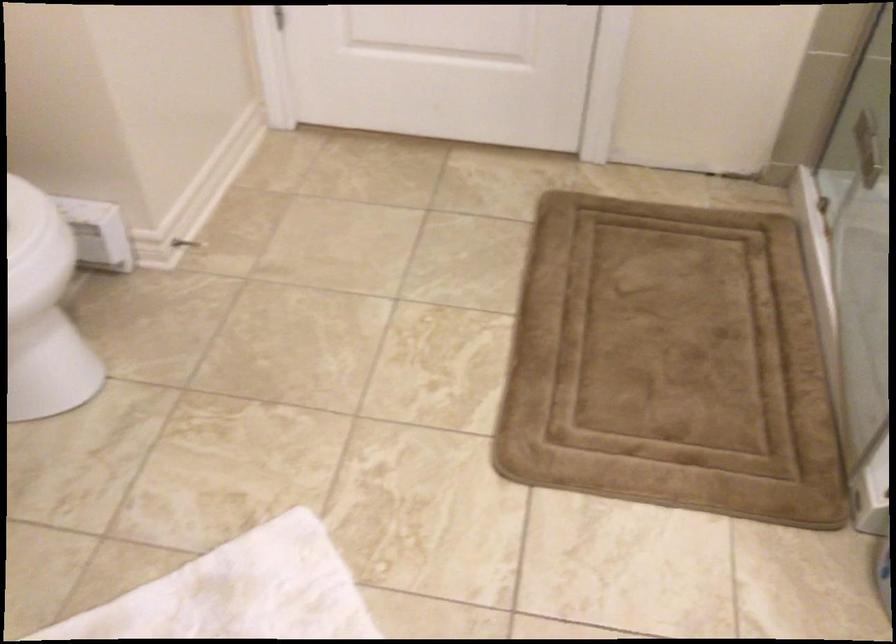
At what (x,y) coordinates should I click in order to perform the action: click on brown bath mat. Please return your answer as a coordinate pair (x, y). Image resolution: width=896 pixels, height=644 pixels. Looking at the image, I should click on (670, 363).